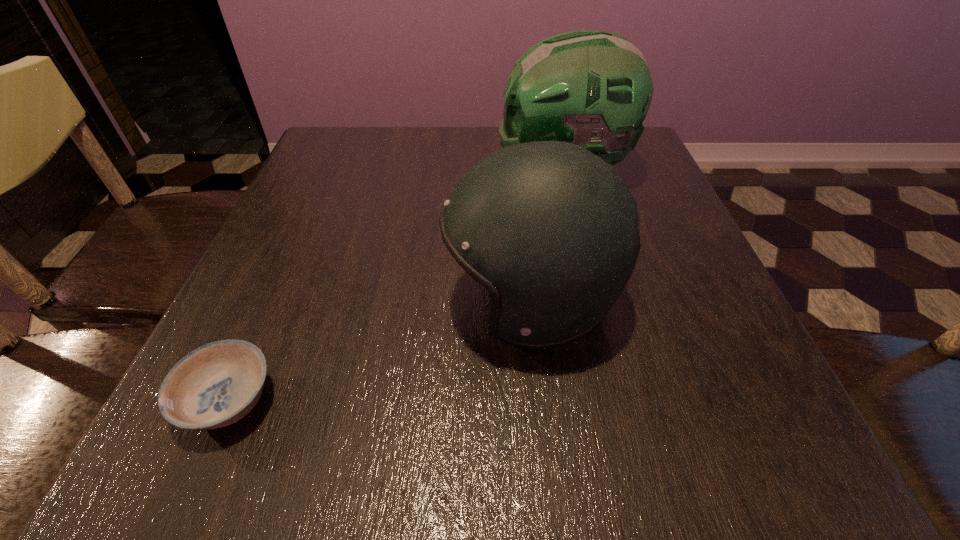
This screenshot has width=960, height=540. I want to click on the farthest object, so click(591, 88).

Identify the location of the nearer football helmet. (550, 229).

Where is `bowl`? The image size is (960, 540). bowl is located at coordinates (216, 385).

At what (x,y) coordinates should I click in order to perform the action: click on the shortest object. Please return your answer as a coordinate pair (x, y). Looking at the image, I should click on (216, 385).

The height and width of the screenshot is (540, 960). I want to click on free spot located 0.080m on the visor of the farthest object, so click(463, 172).

You are a GUI agent. You are given a task and a screenshot of the screen. Output one action in this format:
    pyautogui.click(x=<x>, y=<y>)
    Task: Click on the free space located on the visor of the farthest object
    The height and width of the screenshot is (540, 960).
    Given the screenshot: What is the action you would take?
    pyautogui.click(x=419, y=172)

This screenshot has height=540, width=960. What are the coordinates of `vacant area located 0.340m on the visor of the farthest object` in the screenshot? It's located at (348, 172).

At what (x,y) coordinates should I click in order to perform the action: click on free space located 0.150m at the face opening of the nearer football helmet. Please return your answer as a coordinate pair (x, y). This screenshot has height=540, width=960. Looking at the image, I should click on (354, 301).

Locate an element on the screen. The height and width of the screenshot is (540, 960). vacant position located at the face opening of the nearer football helmet is located at coordinates (252, 301).

Locate an element on the screen. The width and height of the screenshot is (960, 540). vacant space located 0.220m at the face opening of the nearer football helmet is located at coordinates (312, 301).